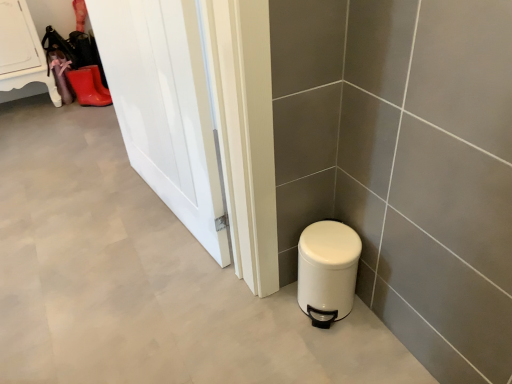
This screenshot has width=512, height=384. I want to click on rubber matte boot at upper left, so (x=89, y=86).

What do you see at coordinates (327, 270) in the screenshot? I see `white matte trash can at lower right` at bounding box center [327, 270].

This screenshot has width=512, height=384. In order to click on white matte trash can at lower right in this screenshot , I will do `click(327, 270)`.

Find the location of a particular element. rubber matte boot at upper left is located at coordinates (89, 86).

Is rubber matte boot at upper left at the right side of white matte trash can at lower right?

No, rubber matte boot at upper left is not to the right of white matte trash can at lower right.

Is rubber matte boot at upper left inside the boundaries of white matte trash can at lower right, or outside?

rubber matte boot at upper left cannot be found inside white matte trash can at lower right.

Considering the sizes of objects rubber matte boot at upper left and white matte trash can at lower right in the image provided, who is wider, rubber matte boot at upper left or white matte trash can at lower right?

Wider between the two is rubber matte boot at upper left.

Based on their sizes in the image, would you say white matte trash can at lower right is bigger or smaller than white glossy door at left?

white matte trash can at lower right is smaller than white glossy door at left.

Between white matte trash can at lower right and white glossy door at left, which one is positioned in front?

white glossy door at left is closer to the camera.

How far apart are white matte trash can at lower right and white glossy door at left?

white matte trash can at lower right and white glossy door at left are 56.42 centimeters apart.

Does white matte trash can at lower right turn towards white glossy door at left?

No, white matte trash can at lower right is not aimed at white glossy door at left.

Which object is further away from the camera taking this photo, white glossy door at left or white matte trash can at lower right?

white matte trash can at lower right is more distant.

Is white glossy door at left taller or shorter than white matte trash can at lower right?

Clearly, white glossy door at left is taller compared to white matte trash can at lower right.

How many degrees apart are the facing directions of white glossy door at left and white matte trash can at lower right?

There is a 83.1-degree angle between the facing directions of white glossy door at left and white matte trash can at lower right.

From a real-world perspective, relative to white matte trash can at lower right, is white glossy door at left vertically above or below?

white glossy door at left is above white matte trash can at lower right.

Is rubber matte boot at upper left inside white glossy door at left?

That's incorrect, rubber matte boot at upper left is not inside white glossy door at left.

Is white glossy door at left placed right next to rubber matte boot at upper left?

white glossy door at left and rubber matte boot at upper left are clearly separated.

I want to click on footwear to the left of white glossy door at left, so tap(89, 86).

Does white glossy door at left have a smaller size compared to rubber matte boot at upper left?

Incorrect, white glossy door at left is not smaller in size than rubber matte boot at upper left.

Between rubber matte boot at upper left and white glossy door at left, which one appears on the right side from the viewer's perspective?

Positioned to the right is white glossy door at left.

Are rubber matte boot at upper left and white glossy door at left located far from each other?

rubber matte boot at upper left is positioned a significant distance from white glossy door at left.

Considering the points (79, 102) and (222, 264), which point is behind, point (79, 102) or point (222, 264)?

The point (79, 102) is behind.

From a real-world perspective, between rubber matte boot at upper left and white glossy door at left, who is vertically lower?

In real-world perspective, rubber matte boot at upper left is lower.

Which object is closer to the camera, white matte trash can at lower right or rubber matte boot at upper left?

white matte trash can at lower right is in front.

Considering the relative sizes of white matte trash can at lower right and rubber matte boot at upper left in the image provided, is white matte trash can at lower right thinner than rubber matte boot at upper left?

Yes, white matte trash can at lower right is thinner than rubber matte boot at upper left.

Considering the positions of point (350, 286) and point (87, 100), is point (350, 286) closer or farther from the camera than point (87, 100)?

Clearly, point (350, 286) is closer to the camera than point (87, 100).

What are the coordinates of `footwear on the left side of white matte trash can at lower right` in the screenshot? It's located at (89, 86).

Find the location of `water heater that appears below the white glossy door at left (from the image's perspective)`. water heater that appears below the white glossy door at left (from the image's perspective) is located at coordinates (327, 270).

Based on their spatial positions, is white matte trash can at lower right or white glossy door at left closer to rubber matte boot at upper left?

The object closer to rubber matte boot at upper left is white glossy door at left.

Considering their positions, is rubber matte boot at upper left positioned closer to white matte trash can at lower right than white glossy door at left?

Based on the image, white glossy door at left appears to be nearer to white matte trash can at lower right.

When comparing their distances from white glossy door at left, does rubber matte boot at upper left or white matte trash can at lower right seem closer?

white matte trash can at lower right.

From the image, which object appears to be farther from rubber matte boot at upper left, white glossy door at left or white matte trash can at lower right?

Based on the image, white matte trash can at lower right appears to be further to rubber matte boot at upper left.

Looking at the image, which one is located closer to white glossy door at left, white matte trash can at lower right or rubber matte boot at upper left?

white matte trash can at lower right is closer to white glossy door at left.

Looking at the image, which one is located closer to white matte trash can at lower right, white glossy door at left or rubber matte boot at upper left?

Among the two, white glossy door at left is located nearer to white matte trash can at lower right.

The image size is (512, 384). Find the location of `water heater between white glossy door at left and rubber matte boot at upper left in the front-back direction`. water heater between white glossy door at left and rubber matte boot at upper left in the front-back direction is located at coordinates (327, 270).